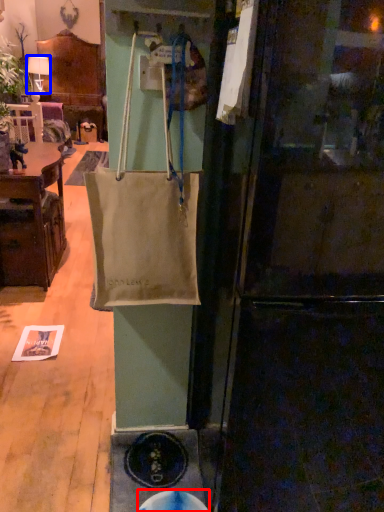
Question: Which object is closer to the camera taking this photo, manhole (highlighted by a red box) or lamp (highlighted by a blue box)?

Choices:
 (A) manhole
 (B) lamp

Answer: (A)